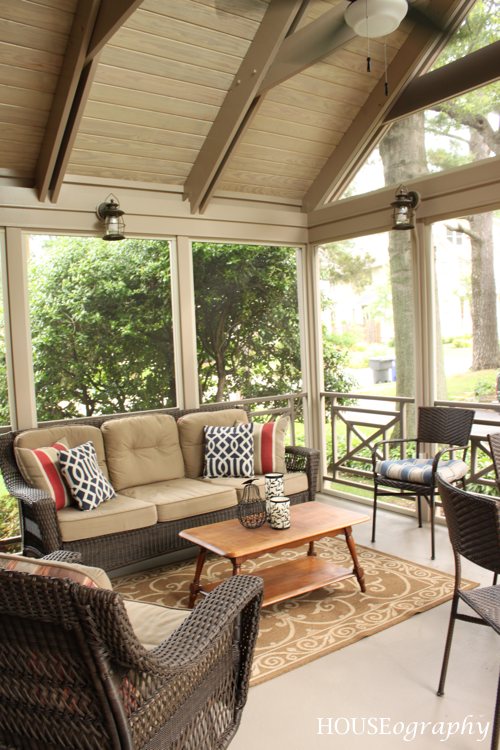
Find the location of `seat cushion`. seat cushion is located at coordinates (152, 620), (123, 517), (183, 500), (296, 481), (420, 471).